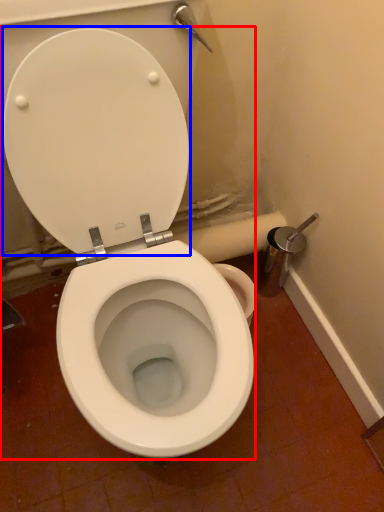
Question: Which object is further to the camera taking this photo, toilet (highlighted by a red box) or back (highlighted by a blue box)?

Choices:
 (A) toilet
 (B) back

Answer: (B)